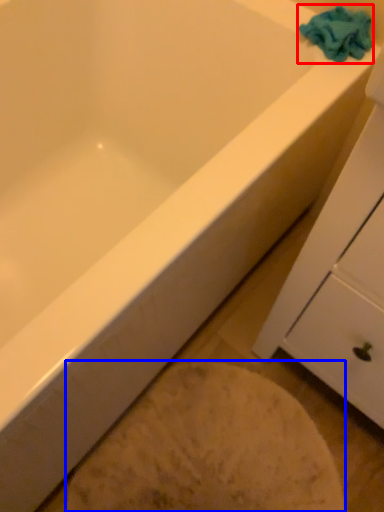
Question: Which object appears closest to the camera in this image, bath towel (highlighted by a red box) or porcelain (highlighted by a blue box)?

Choices:
 (A) bath towel
 (B) porcelain

Answer: (B)